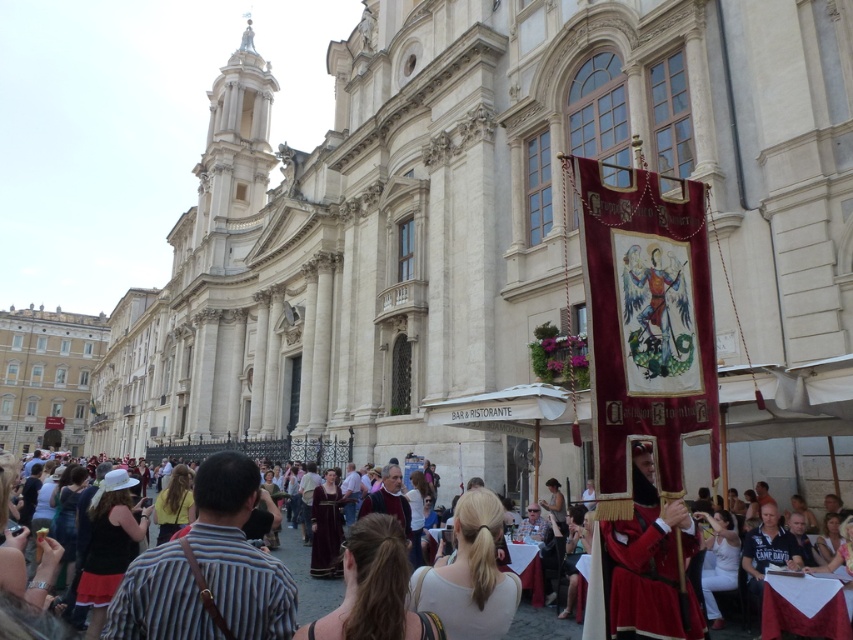
Who is shorter, white stone church at center or yellow fabric dress at center?

yellow fabric dress at center

Is point (569, 259) positioned before point (177, 502)?

No, it is not.

Is point (450, 192) closer to viewer compared to point (178, 468)?

No, it is behind (178, 468).

Find the location of `white stone church at center`. white stone church at center is located at coordinates (479, 224).

Can you confirm if silk red dress at center is positioned to the right of yellow fabric dress at center?

Yes, silk red dress at center is to the right of yellow fabric dress at center.

Does silk red dress at center lie in front of yellow fabric dress at center?

Yes, it is in front of yellow fabric dress at center.

Image resolution: width=853 pixels, height=640 pixels. I want to click on silk red dress at center, so click(718, 561).

Does dark brown leather dress at center appear on the right side of matte black shirt at lower left?

Yes, dark brown leather dress at center is to the right of matte black shirt at lower left.

Does dark brown leather dress at center have a lesser width compared to matte black shirt at lower left?

In fact, dark brown leather dress at center might be wider than matte black shirt at lower left.

Is point (419, 616) less distant than point (97, 499)?

Yes, it is in front of point (97, 499).

At what (x,y) coordinates should I click in order to perform the action: click on dark brown leather dress at center. Please return your answer as a coordinate pair (x, y). The width and height of the screenshot is (853, 640). Looking at the image, I should click on (374, 588).